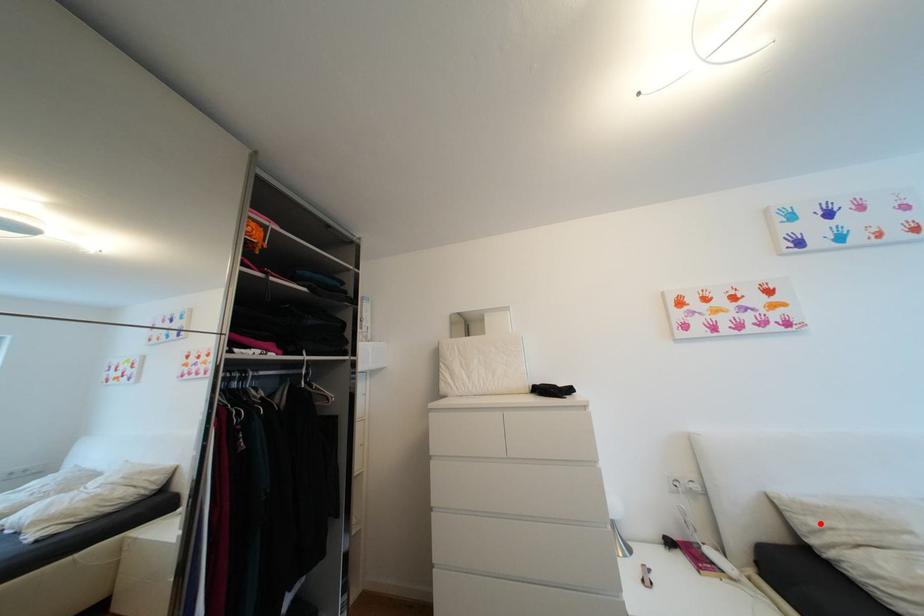
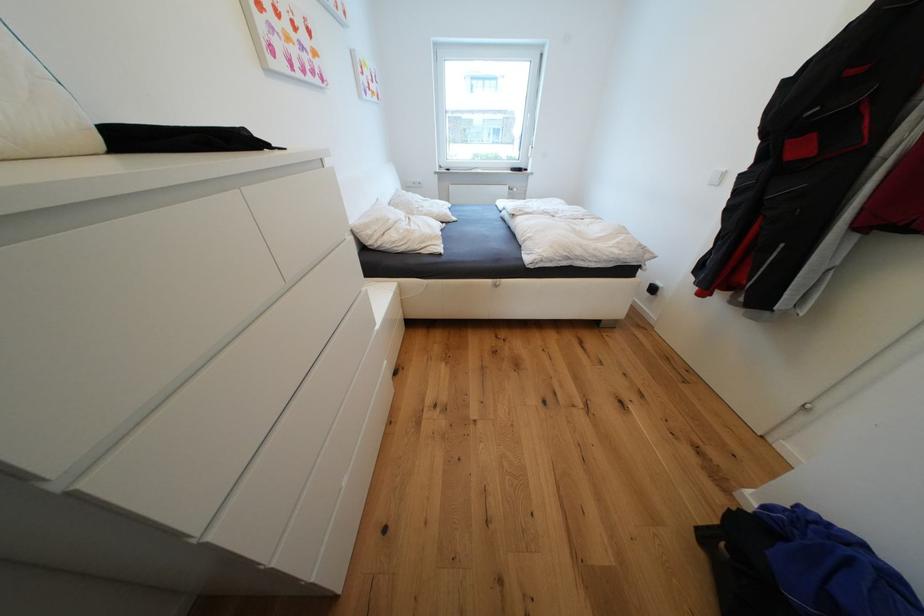
Question: I am providing you with two images of the same scene from different viewpoints. A red point is marked on the first image. Is the red point's position out of view in image 2?

Choices:
 (A) Yes
 (B) No

Answer: (B)